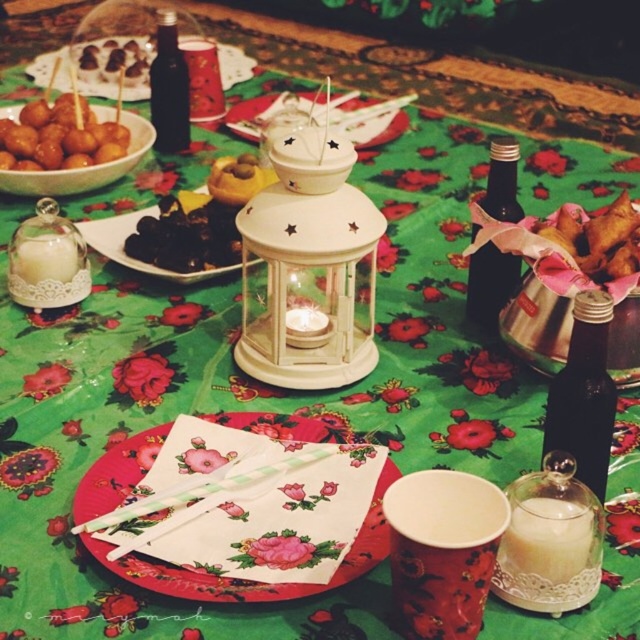
You are a guest at the table and want to place a small dessert on the translucent glass platter at center. However, you only have a dessert that is the same size as the matte brown plate at upper left. Will it fit?

The translucent glass platter at center is smaller than the matte brown plate at upper left, so the dessert will not fit on the translucent glass platter at center.

Consider the image. You are a guest at the festive table and want to grab a drink from the black glass bottle at center and then reach for the translucent glass platter at center. Which item will you need to bend down more to reach?

The black glass bottle at center is taller than the translucent glass platter at center, so you will need to bend down more to reach the translucent glass platter at center.